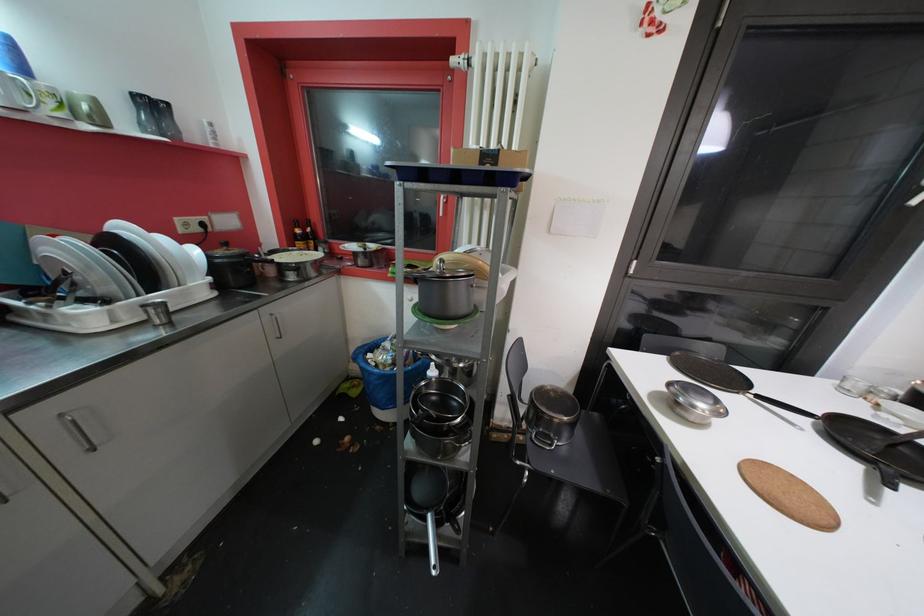
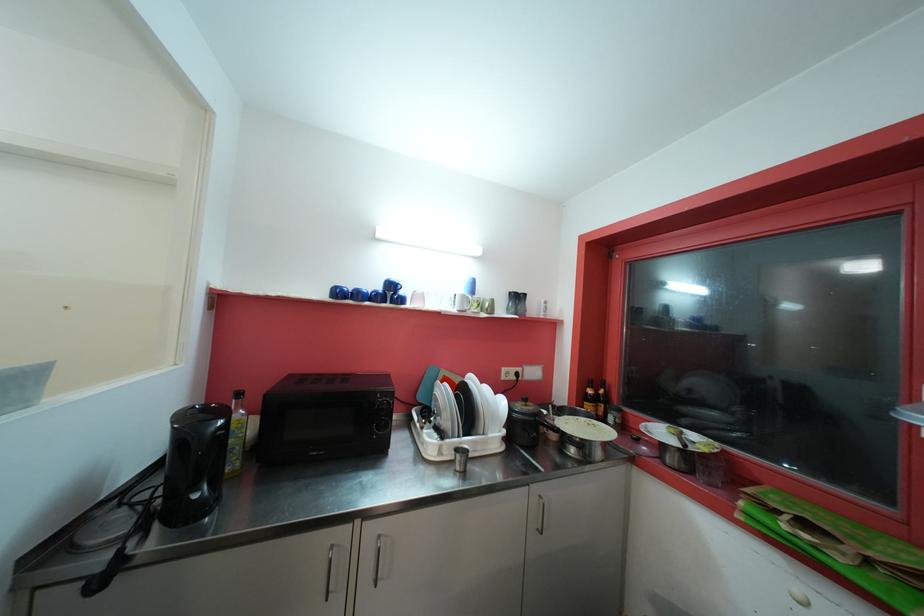
Where in the second image is the point corresponding to the point at 310,240 from the first image?

(601, 402)